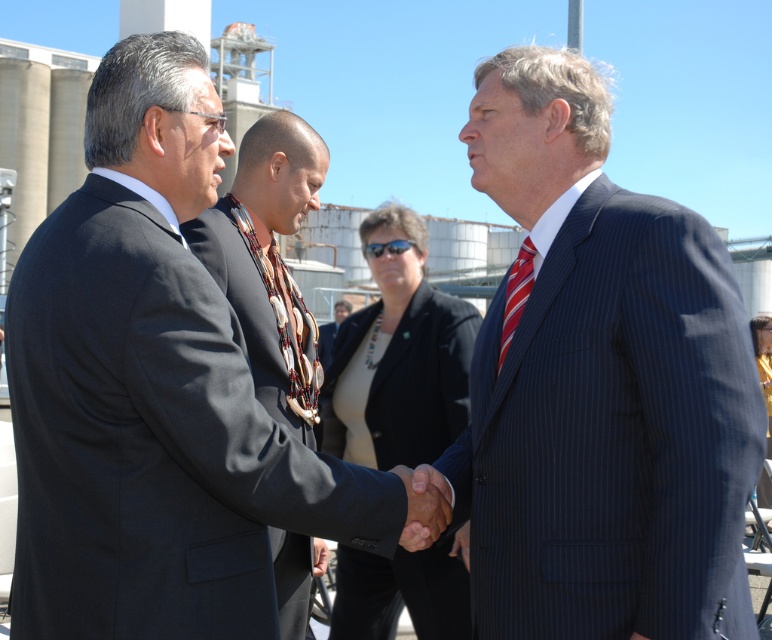
You are a photographer at this event and need to capture a clear photo of both the matte black suit at center and the dark blue suit at center. Which suit should you focus on first to ensure it appears sharp in the photo?

The matte black suit at center is in front of the dark blue suit at center, so focusing on the matte black suit at center first will ensure it appears sharp, and the dark blue suit at center may also be in focus depending on the camera settings.

You are a photographer at this event and need to capture a photo where both the matte black suit at center and the dark blue suit at center are clearly visible. Based on their positions, which suit is closer to the camera?

The matte black suit at center is positioned under the dark blue suit at center, meaning it is closer to the camera.